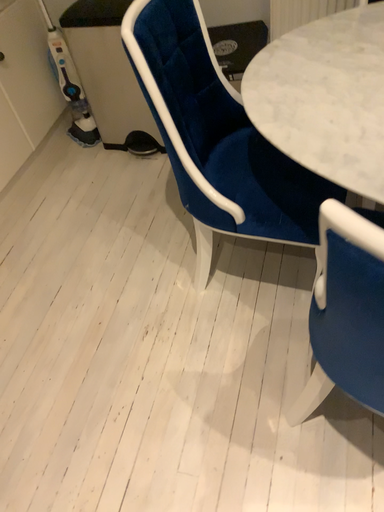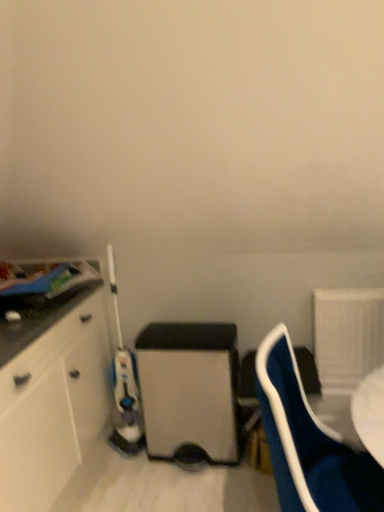
Question: How did the camera likely rotate when shooting the video?

Choices:
 (A) rotated upward
 (B) rotated downward

Answer: (A)